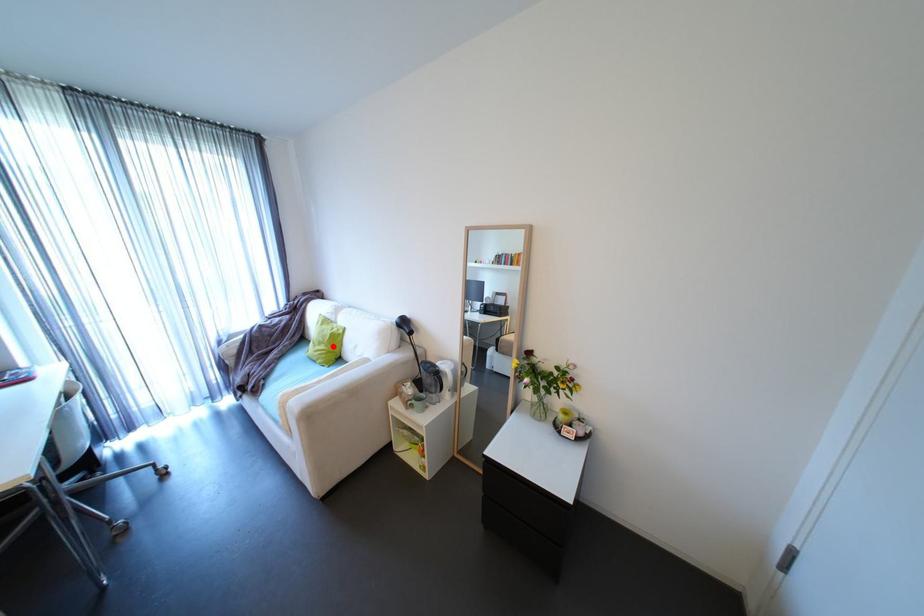
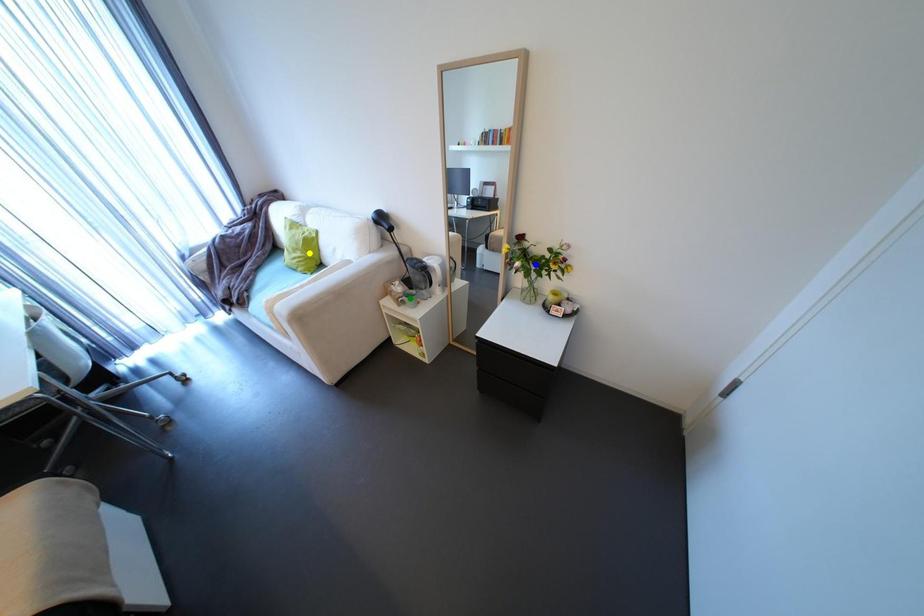
Question: I am providing you with two images of the same scene from different viewpoints. A red point is marked on the first image. You are given multiple points on the second image. Which mark in image 2 goes with the point in image 1?

Choices:
 (A) blue point
 (B) yellow point
 (C) green point

Answer: (B)